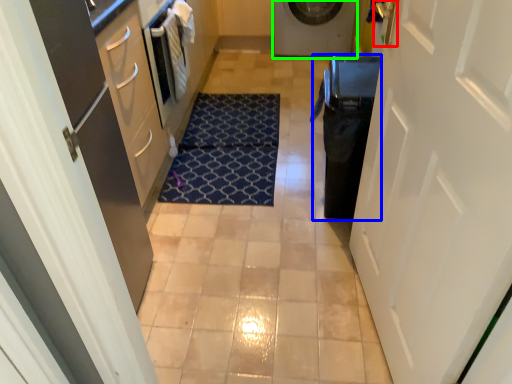
Question: Based on their relative distances, which object is farther from door handle (highlighted by a red box)? Choose from dish washer (highlighted by a blue box) and washing machine (highlighted by a green box).

Choices:
 (A) dish washer
 (B) washing machine

Answer: (B)